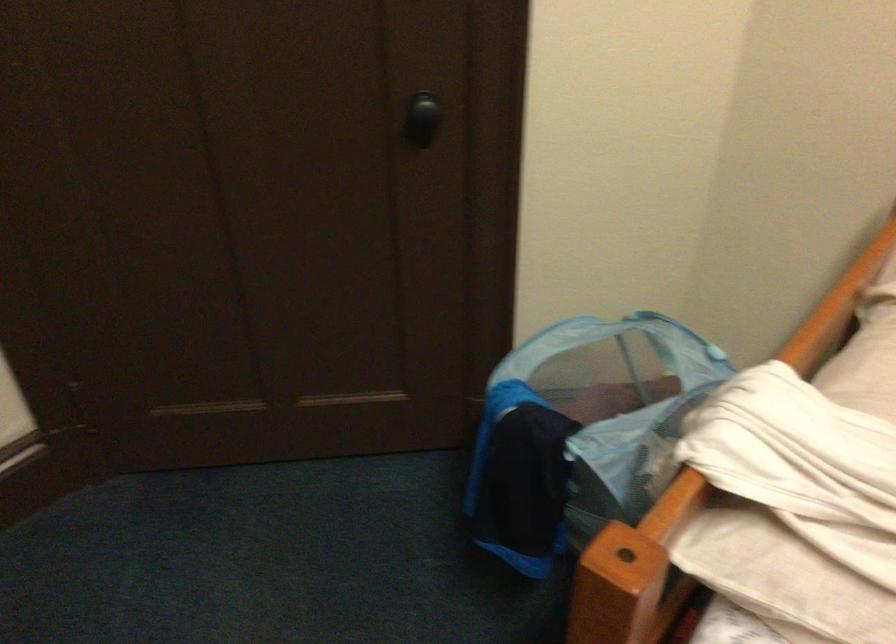
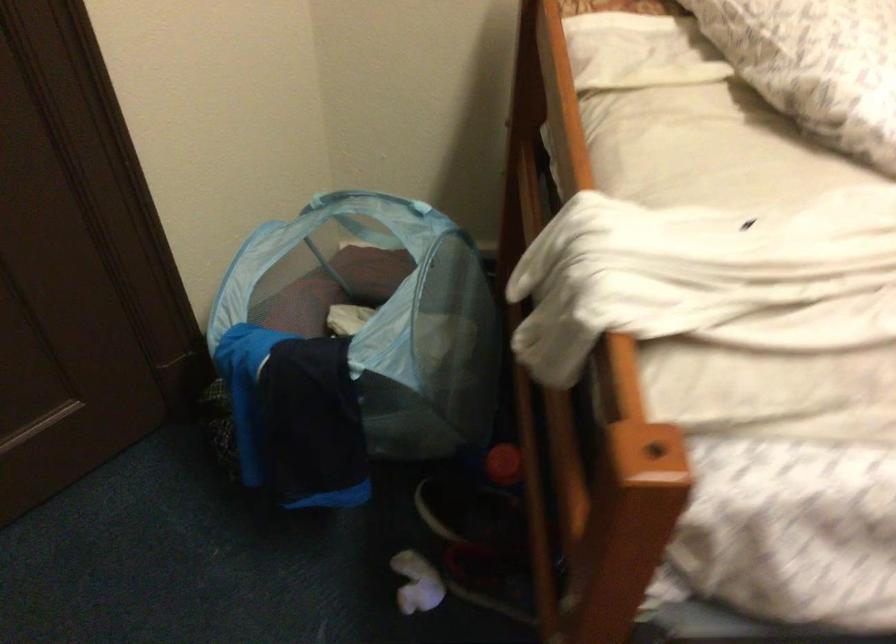
Find the pixel in the second image that matches [586,433] in the first image.

(354, 345)